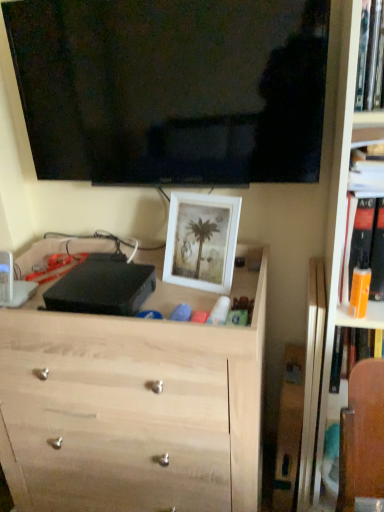
Image resolution: width=384 pixels, height=512 pixels. Find the location of `orange plastic bottle at right, which ranks as the third book in top-to-bottom order`. orange plastic bottle at right, which ranks as the third book in top-to-bottom order is located at coordinates (356, 239).

The height and width of the screenshot is (512, 384). Describe the element at coordinates (367, 168) in the screenshot. I see `hardcover book at upper right, which is counted as the second book, starting from the bottom` at that location.

Identify the location of orange plastic bottle at right, which ranks as the third book in top-to-bottom order. Image resolution: width=384 pixels, height=512 pixels. (356, 239).

Is hardcover book at upper right, which is counted as the second book, starting from the bottom, oriented away from hardcover book at upper right, the first book positioned from the top?

hardcover book at upper right, which is counted as the second book, starting from the bottom, is not turned away from hardcover book at upper right, the first book positioned from the top.

How distant is hardcover book at upper right, which is counted as the second book, starting from the bottom, from hardcover book at upper right, the first book positioned from the top?

hardcover book at upper right, which is counted as the second book, starting from the bottom, and hardcover book at upper right, the first book positioned from the top, are 7.25 inches apart from each other.

Does hardcover book at upper right, which ranks as the second book in top-to-bottom order, have a lesser height compared to hardcover book at upper right, the third book when ordered from bottom to top?

Indeed, hardcover book at upper right, which ranks as the second book in top-to-bottom order, has a lesser height compared to hardcover book at upper right, the third book when ordered from bottom to top.

At what (x,y) coordinates should I click in order to perform the action: click on picture frame that appears below the hardcover book at upper right, which ranks as the second book in top-to-bottom order (from a real-world perspective). Please return your answer as a coordinate pair (x, y). Image resolution: width=384 pixels, height=512 pixels. Looking at the image, I should click on (201, 241).

Is hardcover book at upper right, which ranks as the second book in top-to-bottom order, looking in the opposite direction of white matte picture frame at center?

hardcover book at upper right, which ranks as the second book in top-to-bottom order, does not have its back to white matte picture frame at center.

Between hardcover book at upper right, which is counted as the second book, starting from the bottom, and white matte picture frame at center, which one has more height?

With more height is white matte picture frame at center.

In the scene shown: From a real-world perspective, is hardcover book at upper right, which ranks as the second book in top-to-bottom order, above or below white matte picture frame at center?

hardcover book at upper right, which ranks as the second book in top-to-bottom order, is situated higher than white matte picture frame at center in the real world.

In terms of height, does light wood chest of drawers at center look taller or shorter compared to hardcover book at upper right, which ranks as the second book in top-to-bottom order?

Considering their sizes, light wood chest of drawers at center has more height than hardcover book at upper right, which ranks as the second book in top-to-bottom order.

From the image's perspective, which one is positioned higher, light wood chest of drawers at center or hardcover book at upper right, which ranks as the second book in top-to-bottom order?

hardcover book at upper right, which ranks as the second book in top-to-bottom order, appears higher in the image.

Is light wood chest of drawers at center positioned before hardcover book at upper right, which is counted as the second book, starting from the bottom?

Yes, light wood chest of drawers at center is closer to the camera.

Is light wood chest of drawers at center to the left of hardcover book at upper right, which is counted as the second book, starting from the bottom, from the viewer's perspective?

Yes, light wood chest of drawers at center is to the left of hardcover book at upper right, which is counted as the second book, starting from the bottom.

Would you say hardcover book at upper right, the first book positioned from the top, is outside light wood chest of drawers at center?

Yes, hardcover book at upper right, the first book positioned from the top, is outside of light wood chest of drawers at center.

Is hardcover book at upper right, the third book when ordered from bottom to top, in contact with light wood chest of drawers at center?

No, hardcover book at upper right, the third book when ordered from bottom to top, is not in contact with light wood chest of drawers at center.

From the picture: From a real-world perspective, who is located higher, hardcover book at upper right, the first book positioned from the top, or light wood chest of drawers at center?

hardcover book at upper right, the first book positioned from the top, from a real-world perspective.

From the image's perspective, which is below, orange plastic bottle at right, the first book from the bottom, or hardcover book at upper right, which ranks as the second book in top-to-bottom order?

orange plastic bottle at right, the first book from the bottom, is shown below in the image.

I want to click on book on the right of the orange plastic bottle at right, the first book from the bottom, so click(x=367, y=168).

Is orange plastic bottle at right, the first book from the bottom, wider than hardcover book at upper right, which ranks as the second book in top-to-bottom order?

Indeed, orange plastic bottle at right, the first book from the bottom, has a greater width compared to hardcover book at upper right, which ranks as the second book in top-to-bottom order.

Is orange plastic bottle at right, which ranks as the third book in top-to-bottom order, oriented away from hardcover book at upper right, which ranks as the second book in top-to-bottom order?

orange plastic bottle at right, which ranks as the third book in top-to-bottom order, is not turned away from hardcover book at upper right, which ranks as the second book in top-to-bottom order.

Is black glossy tv at upper center positioned with its back to white matte picture frame at center?

No, black glossy tv at upper center's orientation is not away from white matte picture frame at center.

Between black glossy tv at upper center and white matte picture frame at center, which one is positioned in front?

black glossy tv at upper center is more forward.

Where is `picture frame on the right of black glossy tv at upper center`? Image resolution: width=384 pixels, height=512 pixels. picture frame on the right of black glossy tv at upper center is located at coordinates (201, 241).

From the image's perspective, is black glossy tv at upper center positioned above or below white matte picture frame at center?

black glossy tv at upper center is above white matte picture frame at center.

From the image's perspective, which one is positioned higher, orange plastic bottle at right, the first book from the bottom, or black glossy tv at upper center?

black glossy tv at upper center appears higher in the image.

Considering the sizes of orange plastic bottle at right, which ranks as the third book in top-to-bottom order, and black glossy tv at upper center in the image, is orange plastic bottle at right, which ranks as the third book in top-to-bottom order, wider or thinner than black glossy tv at upper center?

Clearly, orange plastic bottle at right, which ranks as the third book in top-to-bottom order, has more width compared to black glossy tv at upper center.

Is orange plastic bottle at right, the first book from the bottom, inside or outside of black glossy tv at upper center?

orange plastic bottle at right, the first book from the bottom, is located beyond the bounds of black glossy tv at upper center.

Can you confirm if orange plastic bottle at right, which ranks as the third book in top-to-bottom order, is bigger than black glossy tv at upper center?

No.

I want to click on the 2nd book counting from the left of the hardcover book at upper right, which is counted as the second book, starting from the bottom, so click(x=368, y=54).

Find the location of `book that is the 2nd one above the white matte picture frame at center (from a real-world perspective)`. book that is the 2nd one above the white matte picture frame at center (from a real-world perspective) is located at coordinates (367, 168).

When comparing their distances from light wood chest of drawers at center, does hardcover book at upper right, which ranks as the second book in top-to-bottom order, or white matte picture frame at center seem closer?

white matte picture frame at center.

Looking at the image, which one is located closer to light wood chest of drawers at center, black glossy tv at upper center or white matte picture frame at center?

The object closer to light wood chest of drawers at center is white matte picture frame at center.

Estimate the real-world distances between objects in this image. Which object is closer to hardcover book at upper right, the third book when ordered from bottom to top, orange plastic bottle at right, the first book from the bottom, or white matte picture frame at center?

orange plastic bottle at right, the first book from the bottom, lies closer to hardcover book at upper right, the third book when ordered from bottom to top, than the other object.

From the image, which object appears to be farther from white matte picture frame at center, hardcover book at upper right, which ranks as the second book in top-to-bottom order, or light wood chest of drawers at center?

hardcover book at upper right, which ranks as the second book in top-to-bottom order, lies further to white matte picture frame at center than the other object.

Based on their spatial positions, is light wood chest of drawers at center or black glossy tv at upper center closer to hardcover book at upper right, the third book when ordered from bottom to top?

Based on the image, black glossy tv at upper center appears to be nearer to hardcover book at upper right, the third book when ordered from bottom to top.

Considering their positions, is white matte picture frame at center positioned further to hardcover book at upper right, the third book when ordered from bottom to top, than hardcover book at upper right, which ranks as the second book in top-to-bottom order?

white matte picture frame at center lies further to hardcover book at upper right, the third book when ordered from bottom to top, than the other object.

Looking at the image, which one is located closer to black glossy tv at upper center, white matte picture frame at center or light wood chest of drawers at center?

The object closer to black glossy tv at upper center is white matte picture frame at center.

Based on their spatial positions, is orange plastic bottle at right, the first book from the bottom, or white matte picture frame at center further from light wood chest of drawers at center?

orange plastic bottle at right, the first book from the bottom, is further to light wood chest of drawers at center.

This screenshot has height=512, width=384. In order to click on picture frame between hardcover book at upper right, which ranks as the second book in top-to-bottom order, and light wood chest of drawers at center, in the vertical direction in this screenshot , I will do `click(201, 241)`.

Where is `picture frame between black glossy tv at upper center and hardcover book at upper right, which ranks as the second book in top-to-bottom order, in the horizontal direction`? picture frame between black glossy tv at upper center and hardcover book at upper right, which ranks as the second book in top-to-bottom order, in the horizontal direction is located at coordinates (201, 241).

Where is `picture frame between black glossy tv at upper center and light wood chest of drawers at center vertically`? This screenshot has height=512, width=384. picture frame between black glossy tv at upper center and light wood chest of drawers at center vertically is located at coordinates (201, 241).

Image resolution: width=384 pixels, height=512 pixels. I want to click on picture frame situated between black glossy tv at upper center and orange plastic bottle at right, the first book from the bottom, from left to right, so [x=201, y=241].